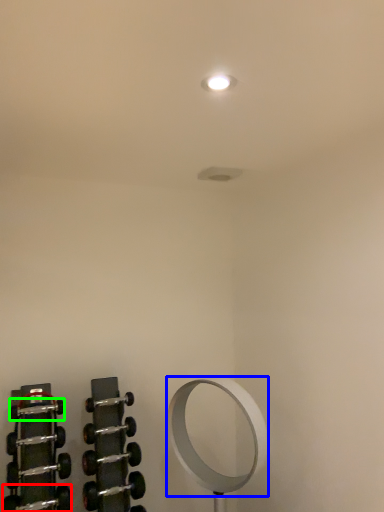
Question: Which is farther away from dumbbell (highlighted by a red box)? mirror (highlighted by a blue box) or dumbbell (highlighted by a green box)?

Choices:
 (A) mirror
 (B) dumbbell

Answer: (A)